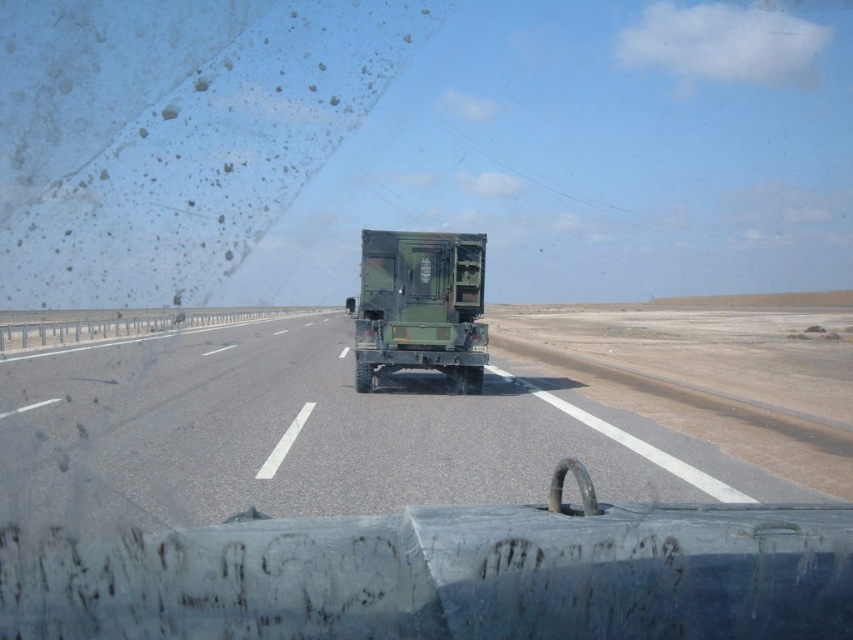
Question: Can you confirm if gray asphalt highway at center is thinner than green matte trailer truck at center?

Choices:
 (A) no
 (B) yes

Answer: (A)

Question: Is gray asphalt highway at center wider than green matte trailer truck at center?

Choices:
 (A) yes
 (B) no

Answer: (A)

Question: Which point is farther from the camera taking this photo?

Choices:
 (A) (244, 390)
 (B) (381, 365)

Answer: (A)

Question: Which point appears farthest from the camera in this image?

Choices:
 (A) (421, 257)
 (B) (213, 428)

Answer: (A)

Question: Which object is closer to the camera taking this photo?

Choices:
 (A) gray asphalt highway at center
 (B) green matte trailer truck at center

Answer: (A)

Question: Is gray asphalt highway at center positioned at the back of green matte trailer truck at center?

Choices:
 (A) no
 (B) yes

Answer: (A)